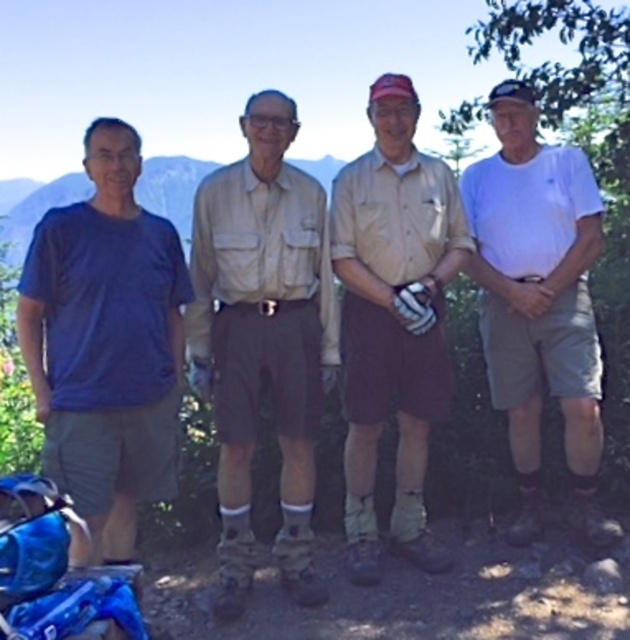
You are a photographer standing at the origin of the coordinate system. You see a point at coordinates point (105, 346). What object is located at that point?

The point (105, 346) indicates the location of the blue cotton shirt at left.

You are a photographer trying to capture a group photo of the hikers. You need to ensure there is enough space between the blue cotton shirt at left and the beige fabric shirt at center for proper framing. The minimum required distance for your camera lens is 20 inches. Can you achieve this with the current positioning?

The blue cotton shirt at left is 22.27 inches from the beige fabric shirt at center, which exceeds the minimum required distance of 20 inches. Therefore, the current positioning allows for proper framing with your camera lens.